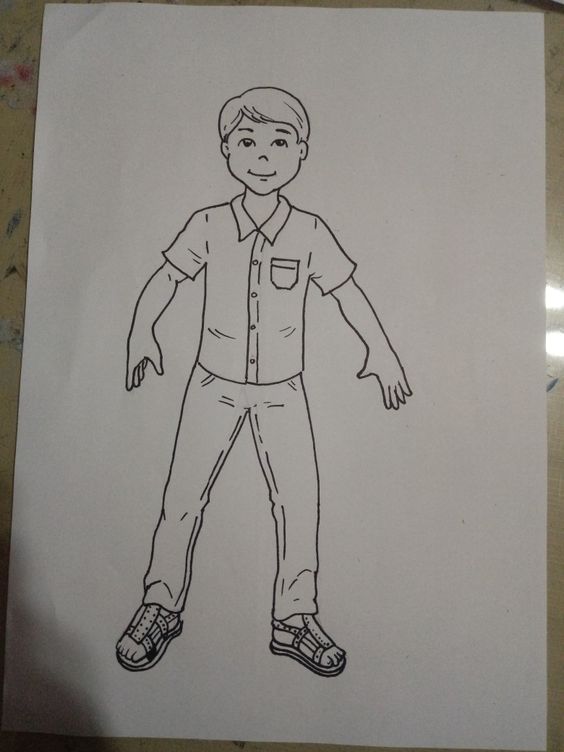
I want to click on marble table, so 23,71.